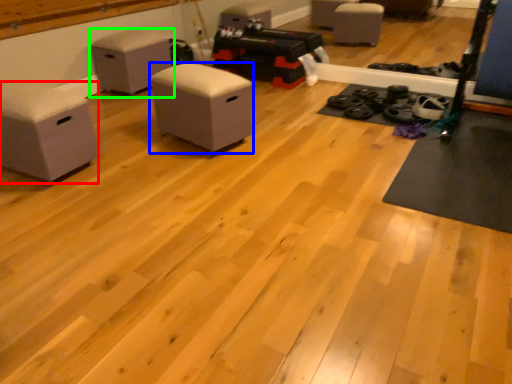
Question: Based on their relative distances, which object is farther from furniture (highlighted by a red box)? Choose from furniture (highlighted by a blue box) and furniture (highlighted by a green box).

Choices:
 (A) furniture
 (B) furniture

Answer: (B)